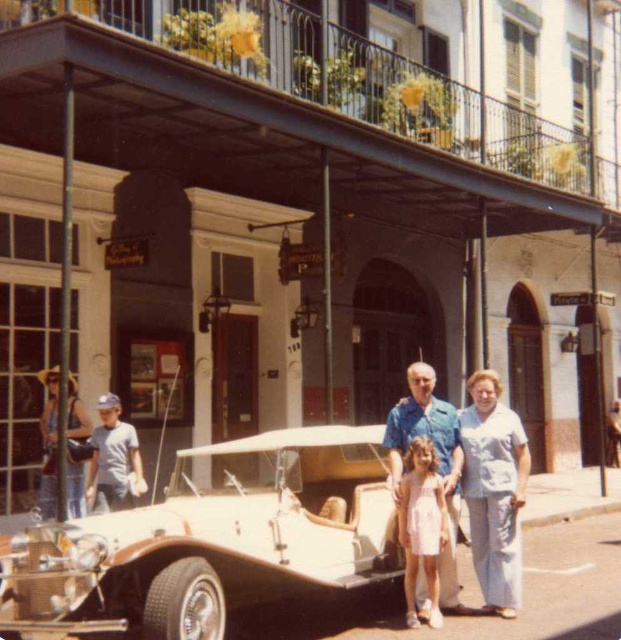
You are a photographer standing in front of the Photography shop entrance. You see a beige leather car at center and a pink satin dress at center. Which object is shorter?

The beige leather car at center is not as tall as the pink satin dress at center, so the beige leather car at center is shorter.

You are a delivery person who needs to place a package on the ground between the pink satin dress at center and the denim jacket at left. The package requires a space of 3 meters. Is there enough space between them?

The pink satin dress at center is 3.85 meters away from the denim jacket at left, so yes, there is enough space between them to place the package since the distance is greater than the required 3 meters.